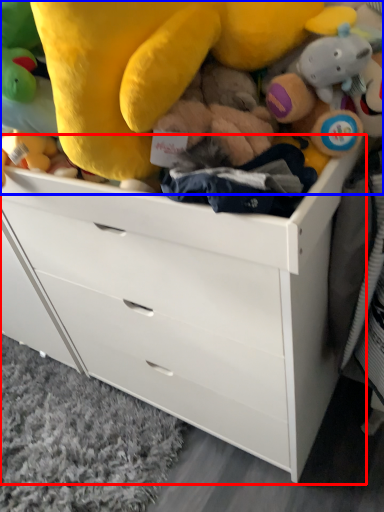
Question: Which of the following is the farthest to the observer, chest of drawers (highlighted by a red box) or toy (highlighted by a blue box)?

Choices:
 (A) chest of drawers
 (B) toy

Answer: (A)